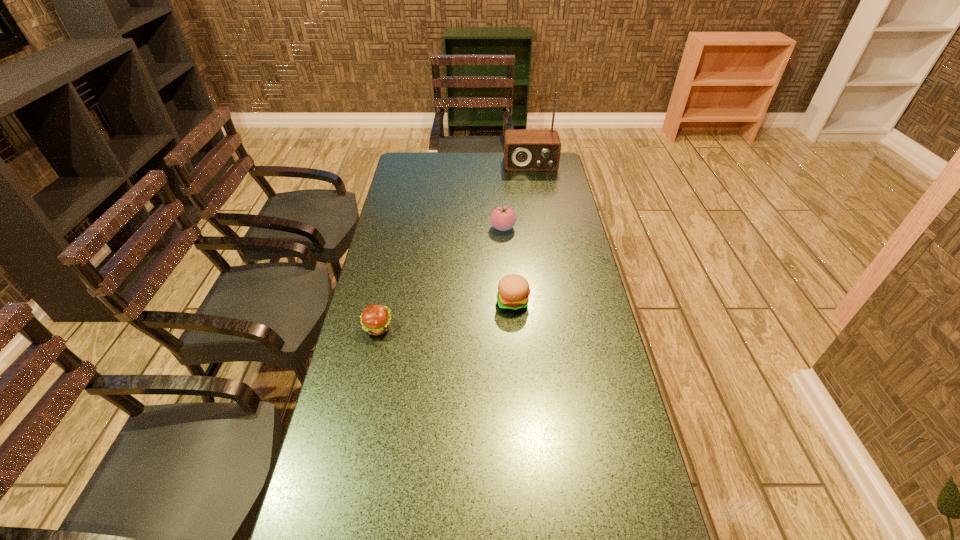
Find the location of a particular element. This screenshot has height=540, width=960. blank region between the farther hamburger and the shorter hamburger is located at coordinates (445, 315).

This screenshot has height=540, width=960. Find the location of `free space between the tallest object and the nearer hamburger`. free space between the tallest object and the nearer hamburger is located at coordinates (454, 246).

I want to click on unoccupied position between the farthest object and the taller hamburger, so click(521, 233).

I want to click on unoccupied position between the farthest object and the third farthest object, so click(x=521, y=233).

The width and height of the screenshot is (960, 540). Find the location of `free space between the tallest object and the second farthest object`. free space between the tallest object and the second farthest object is located at coordinates pyautogui.click(x=516, y=196).

This screenshot has width=960, height=540. I want to click on blank region between the left hamburger and the taller hamburger, so click(445, 315).

At what (x,y) coordinates should I click in order to perform the action: click on vacant point located between the right hamburger and the tomato. Please return your answer as a coordinate pair (x, y). The width and height of the screenshot is (960, 540). Looking at the image, I should click on (508, 265).

Choose which object is the nearest neighbor to the farthest object. Please provide its 2D coordinates. Your answer should be formatted as a tuple, i.e. [(x, y)], where the tuple contains the x and y coordinates of a point satisfying the conditions above.

[(502, 218)]

Find the location of a particular element. This screenshot has width=960, height=540. object that is the closest to the second nearest object is located at coordinates (502, 218).